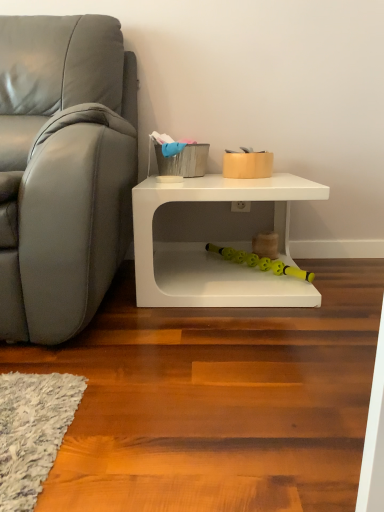
Image resolution: width=384 pixels, height=512 pixels. I want to click on free location in front of white matte table at lower right, so point(221,344).